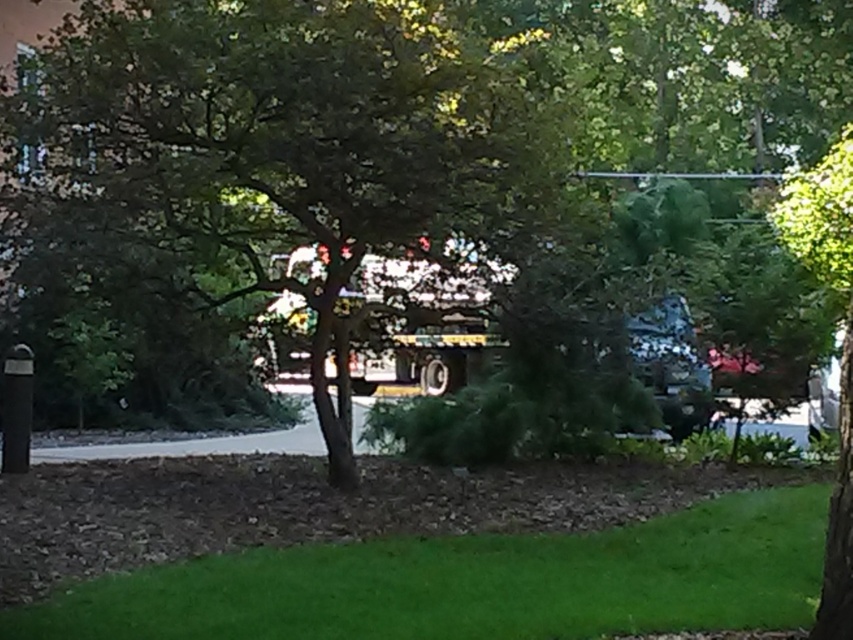
You are standing at the origin point in this outdoor scene. Where is the green leafy tree at center located in terms of coordinates?

The green leafy tree at center is located at coordinates point (296, 172).

You are a gardener who wants to plant a new flower bed between the green leafy tree at center and the green grass at lower center. Considering their heights, which object might block sunlight for the flowers?

The green leafy tree at center has a greater height compared to green grass at lower center, so it might block sunlight for the flowers.

Based on the photo, you are standing in the outdoor scene and want to walk towards the point marked at coordinates (247, 273). How far will you have to walk to reach that point?

The point marked at coordinates (247, 273) is 10.76 meters away from the viewer, so you will have to walk 10.76 meters to reach it.